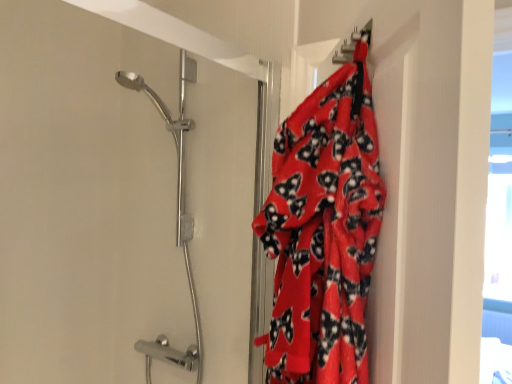
I want to click on polished chrome shower head at upper left, so click(178, 177).

The width and height of the screenshot is (512, 384). What do you see at coordinates (178, 177) in the screenshot?
I see `polished chrome shower head at upper left` at bounding box center [178, 177].

What do you see at coordinates (323, 232) in the screenshot? This screenshot has width=512, height=384. I see `fluffy red blanket at right` at bounding box center [323, 232].

Identify the location of fluffy red blanket at right. This screenshot has width=512, height=384. (323, 232).

Locate an element on the screen. polished chrome shower head at upper left is located at coordinates (178, 177).

Visually, is polished chrome shower head at upper left positioned to the left or to the right of fluffy red blanket at right?

polished chrome shower head at upper left is to the left of fluffy red blanket at right.

Is polished chrome shower head at upper left in front of or behind fluffy red blanket at right in the image?

polished chrome shower head at upper left is positioned farther from the viewer than fluffy red blanket at right.

Is point (183, 139) more distant than point (311, 138)?

Yes, it is.

From the image's perspective, would you say polished chrome shower head at upper left is shown under fluffy red blanket at right?

Correct, polished chrome shower head at upper left appears lower than fluffy red blanket at right in the image.

From a real-world perspective, is polished chrome shower head at upper left on top of fluffy red blanket at right?

No, from a real-world perspective, polished chrome shower head at upper left is not on top of fluffy red blanket at right.

Considering the sizes of polished chrome shower head at upper left and fluffy red blanket at right in the image, is polished chrome shower head at upper left wider or thinner than fluffy red blanket at right?

polished chrome shower head at upper left is wider than fluffy red blanket at right.

Based on the photo, between polished chrome shower head at upper left and fluffy red blanket at right, which one has less height?

fluffy red blanket at right.

Looking at this image, does polished chrome shower head at upper left have a smaller size compared to fluffy red blanket at right?

No, polished chrome shower head at upper left is not smaller than fluffy red blanket at right.

Is polished chrome shower head at upper left outside of fluffy red blanket at right?

polished chrome shower head at upper left is positioned outside fluffy red blanket at right.

Is polished chrome shower head at upper left directly adjacent to fluffy red blanket at right?

No, polished chrome shower head at upper left is not in contact with fluffy red blanket at right.

Is polished chrome shower head at upper left oriented towards fluffy red blanket at right?

No.

How many degrees apart are the facing directions of polished chrome shower head at upper left and fluffy red blanket at right?

57 degrees.

Where is `blanket located above the polished chrome shower head at upper left (from the image's perspective)`? The height and width of the screenshot is (384, 512). blanket located above the polished chrome shower head at upper left (from the image's perspective) is located at coordinates (323, 232).

Which object is positioned more to the right, fluffy red blanket at right or polished chrome shower head at upper left?

Positioned to the right is fluffy red blanket at right.

In the image, is fluffy red blanket at right positioned in front of or behind polished chrome shower head at upper left?

fluffy red blanket at right is positioned closer to the viewer than polished chrome shower head at upper left.

Between point (265, 236) and point (255, 189), which one is positioned behind?

The point (255, 189) is more distant.

From the image's perspective, is fluffy red blanket at right located above polished chrome shower head at upper left?

Yes, from the image's perspective, fluffy red blanket at right is on top of polished chrome shower head at upper left.

From a real-world perspective, does fluffy red blanket at right sit lower than polished chrome shower head at upper left?

No, from a real-world perspective, fluffy red blanket at right is not below polished chrome shower head at upper left.

Looking at their sizes, would you say fluffy red blanket at right is wider or thinner than polished chrome shower head at upper left?

fluffy red blanket at right is thinner than polished chrome shower head at upper left.

Which of these two, fluffy red blanket at right or polished chrome shower head at upper left, stands shorter?

Standing shorter between the two is fluffy red blanket at right.

Can you confirm if fluffy red blanket at right is smaller than polished chrome shower head at upper left?

Indeed, fluffy red blanket at right has a smaller size compared to polished chrome shower head at upper left.

Is polished chrome shower head at upper left located within fluffy red blanket at right?

That's incorrect, polished chrome shower head at upper left is not inside fluffy red blanket at right.

Does fluffy red blanket at right touch polished chrome shower head at upper left?

fluffy red blanket at right and polished chrome shower head at upper left are clearly separated.

Is fluffy red blanket at right aimed at polished chrome shower head at upper left?

No, fluffy red blanket at right is not facing towards polished chrome shower head at upper left.

How different are the orientations of fluffy red blanket at right and polished chrome shower head at upper left in degrees?

The angular difference between fluffy red blanket at right and polished chrome shower head at upper left is 57 degrees.

Identify the location of blanket above the polished chrome shower head at upper left (from the image's perspective). (323, 232).

This screenshot has width=512, height=384. Find the location of `blanket located in front of the polished chrome shower head at upper left`. blanket located in front of the polished chrome shower head at upper left is located at coordinates (323, 232).

Where is `blanket above the polished chrome shower head at upper left (from a real-world perspective)`? blanket above the polished chrome shower head at upper left (from a real-world perspective) is located at coordinates (323, 232).